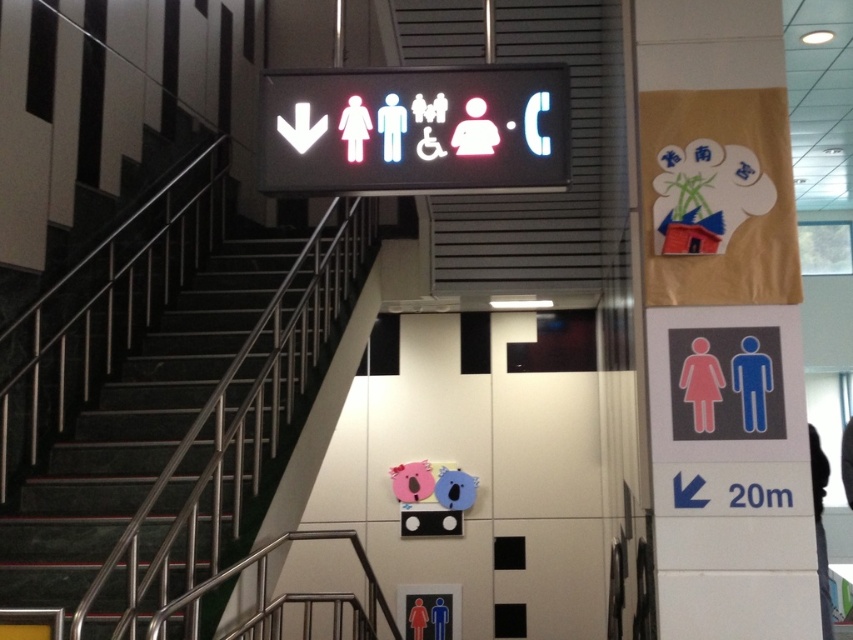
Is black marble stairs at left thinner than white plastic sign at center?

No, black marble stairs at left is not thinner than white plastic sign at center.

Can you confirm if black marble stairs at left is taller than white plastic sign at center?

Yes.

Find the location of a particular element. Image resolution: width=853 pixels, height=640 pixels. black marble stairs at left is located at coordinates (184, 438).